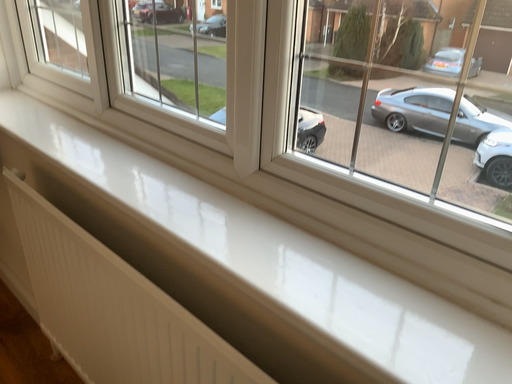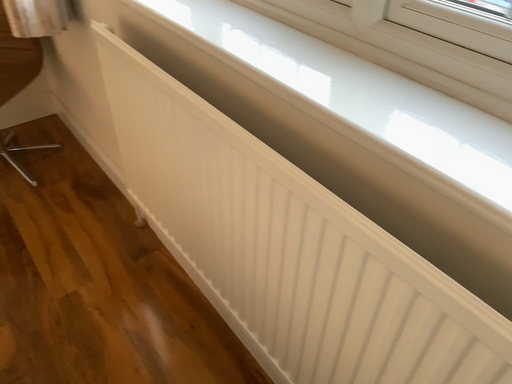
Question: How did the camera likely rotate when shooting the video?

Choices:
 (A) rotated left
 (B) rotated right

Answer: (A)